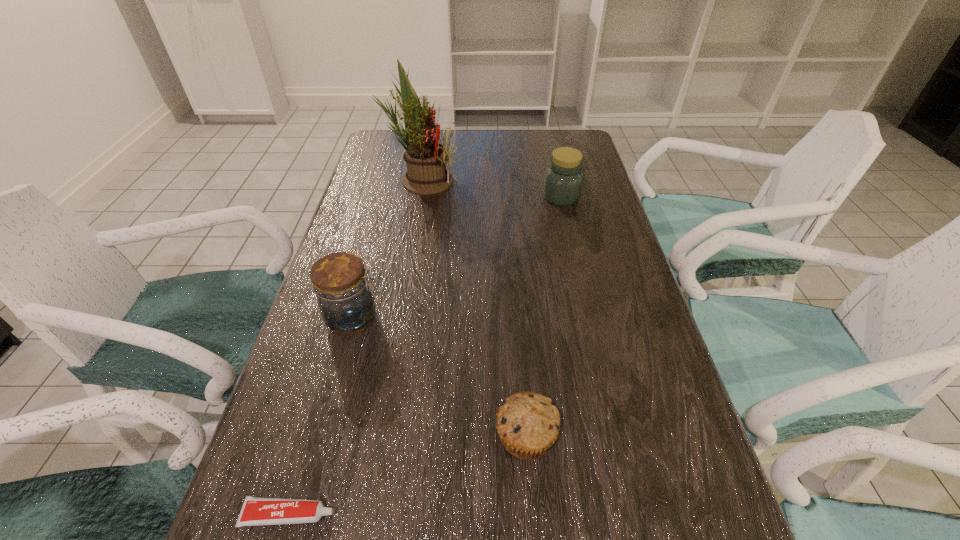
Locate an element on the screen. The image size is (960, 540). unoccupied area between the nearer jar and the nearest object is located at coordinates (322, 416).

Find the location of a particular element. The image size is (960, 540). free spot between the rightmost object and the nearer jar is located at coordinates (458, 258).

Identify the location of blank region between the muffin and the nearer jar. (440, 377).

Where is `free space between the muffin and the tallest object`? This screenshot has width=960, height=540. free space between the muffin and the tallest object is located at coordinates (473, 308).

The width and height of the screenshot is (960, 540). I want to click on vacant region between the toothpaste and the muffin, so click(408, 475).

Locate an element on the screen. The height and width of the screenshot is (540, 960). free space between the muffin and the shortest object is located at coordinates (408, 475).

In order to click on free point between the right jar and the nearest object in this screenshot , I will do `click(425, 356)`.

Find the location of a particular element. This screenshot has width=960, height=540. vacant space that's between the toothpaste and the tallest object is located at coordinates (356, 347).

Find the location of a particular element. empty space between the toothpaste and the third farthest object is located at coordinates (322, 416).

Locate an element on the screen. The height and width of the screenshot is (540, 960). free space between the toothpaste and the right jar is located at coordinates (425, 356).